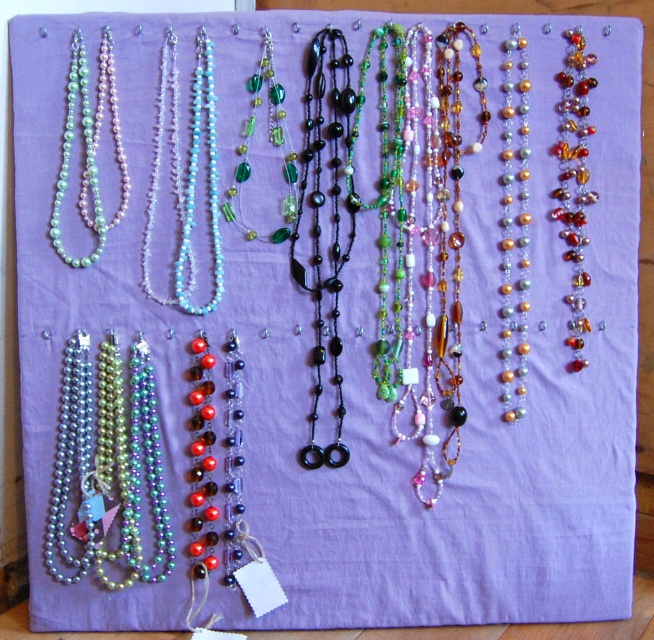
Is point (305, 444) positioned before point (160, 72)?

No, (305, 444) is behind (160, 72).

Is point (313, 461) more distant than point (167, 84)?

That is True.

At what (x,y) coordinates should I click in order to perform the action: click on black glass beads at center. Please return your answer as a coordinate pair (x, y). The width and height of the screenshot is (654, 640). Looking at the image, I should click on (320, 221).

Where is `black glass beads at center`? This screenshot has width=654, height=640. black glass beads at center is located at coordinates (320, 221).

Is black glass beads at center positioned before pearl-like beads at upper left?

No, black glass beads at center is behind pearl-like beads at upper left.

Is point (334, 148) closer to viewer compared to point (95, 131)?

No, it is behind (95, 131).

Does point (305, 72) come closer to viewer compared to point (90, 211)?

Yes, point (305, 72) is in front of point (90, 211).

You are a GUI agent. You are given a task and a screenshot of the screen. Output one action in this format:
    pyautogui.click(x=<x>, y=<y>)
    Task: Click on the black glass beads at center
    This screenshot has width=654, height=640.
    Given the screenshot: What is the action you would take?
    click(x=320, y=221)

Does metallic beads at center have a lesser height compared to black glass beads at center?

Indeed, metallic beads at center has a lesser height compared to black glass beads at center.

Is point (146, 362) positioned in front of point (313, 285)?

Yes, point (146, 362) is in front of point (313, 285).

You are a GUI agent. You are given a task and a screenshot of the screen. Output one action in this format:
    pyautogui.click(x=<x>, y=<y>)
    Task: Click on the metallic beads at center
    The image size is (654, 640).
    Given the screenshot: What is the action you would take?
    pyautogui.click(x=107, y=470)